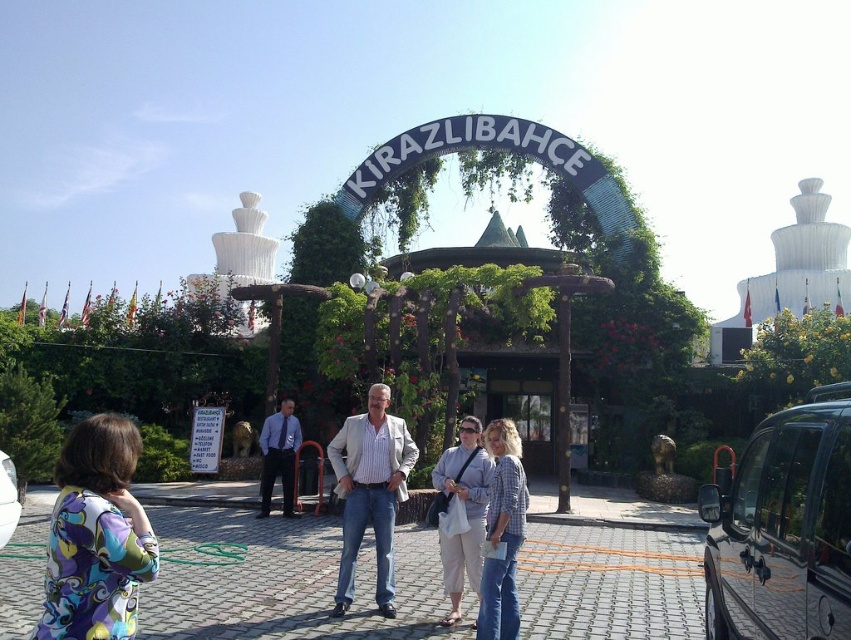
Is green leafy arch at center wider than plaid shirt at center?

Indeed, green leafy arch at center has a greater width compared to plaid shirt at center.

Between green leafy arch at center and plaid shirt at center, which one has less height?

With less height is plaid shirt at center.

Locate an element on the screen. The image size is (851, 640). green leafy arch at center is located at coordinates (495, 148).

Image resolution: width=851 pixels, height=640 pixels. I want to click on green leafy arch at center, so click(x=495, y=148).

Does striped cotton shirt at center appear over light blue shirt at center?

No, striped cotton shirt at center is not above light blue shirt at center.

Locate an element on the screen. The image size is (851, 640). striped cotton shirt at center is located at coordinates (370, 492).

I want to click on striped cotton shirt at center, so point(370,492).

Who is shorter, striped cotton shirt at center or light beige pants at center?

Standing shorter between the two is light beige pants at center.

Does striped cotton shirt at center lie behind light beige pants at center?

Yes, striped cotton shirt at center is further from the viewer.

Locate an element on the screen. The image size is (851, 640). striped cotton shirt at center is located at coordinates (370, 492).